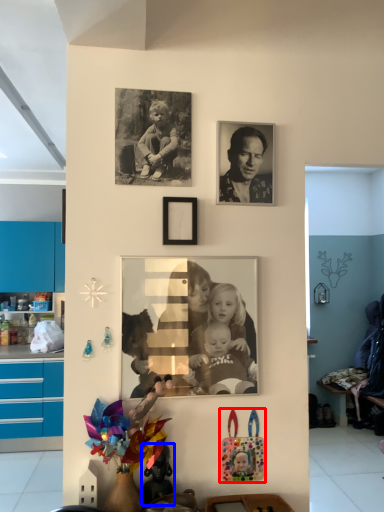
Question: Among these objects, which one is farthest to the camera, toy (highlighted by a red box) or toy (highlighted by a blue box)?

Choices:
 (A) toy
 (B) toy

Answer: (A)